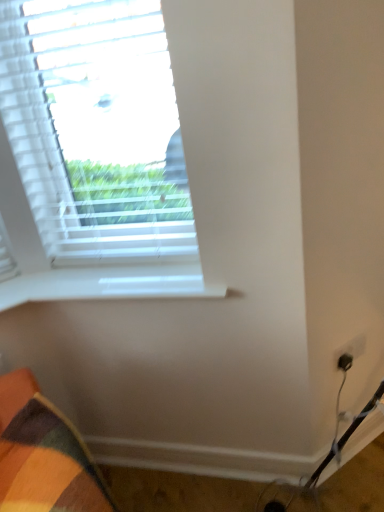
Question: Are white matte window at upper left and white smooth window sill at upper left making contact?

Choices:
 (A) no
 (B) yes

Answer: (A)

Question: Is white matte window at upper left closer to camera compared to white smooth window sill at upper left?

Choices:
 (A) yes
 (B) no

Answer: (A)

Question: Would you consider white matte window at upper left to be distant from white smooth window sill at upper left?

Choices:
 (A) yes
 (B) no

Answer: (B)

Question: Can you confirm if white matte window at upper left is wider than white smooth window sill at upper left?

Choices:
 (A) no
 (B) yes

Answer: (A)

Question: Can we say white matte window at upper left lies outside white smooth window sill at upper left?

Choices:
 (A) yes
 (B) no

Answer: (A)

Question: From a real-world perspective, is white matte window at upper left on top of white smooth window sill at upper left?

Choices:
 (A) yes
 (B) no

Answer: (A)

Question: Is white smooth window sill at upper left shorter than white matte window at upper left?

Choices:
 (A) no
 (B) yes

Answer: (B)

Question: From the image's perspective, is white smooth window sill at upper left on top of white matte window at upper left?

Choices:
 (A) yes
 (B) no

Answer: (B)

Question: Is white smooth window sill at upper left outside white matte window at upper left?

Choices:
 (A) yes
 (B) no

Answer: (A)

Question: Is white smooth window sill at upper left smaller than white matte window at upper left?

Choices:
 (A) yes
 (B) no

Answer: (A)

Question: From a real-world perspective, is white smooth window sill at upper left over white matte window at upper left?

Choices:
 (A) no
 (B) yes

Answer: (A)

Question: Does white smooth window sill at upper left have a greater height compared to white matte window at upper left?

Choices:
 (A) yes
 (B) no

Answer: (B)

Question: From the image's perspective, is white smooth window sill at upper left located above or below white matte window at upper left?

Choices:
 (A) below
 (B) above

Answer: (A)